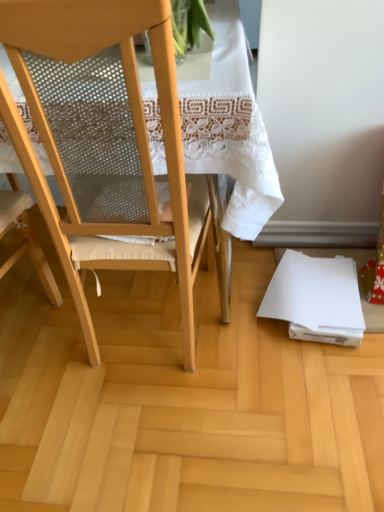
The image size is (384, 512). What are the coordinates of `matte wood chair at center` in the screenshot? It's located at (103, 141).

What do you see at coordinates (182, 402) in the screenshot? The height and width of the screenshot is (512, 384). I see `wooden floor at lower right` at bounding box center [182, 402].

At what (x,y) coordinates should I click in order to perform the action: click on matte wood chair at center. Please return your answer as a coordinate pair (x, y). Looking at the image, I should click on (103, 141).

Image resolution: width=384 pixels, height=512 pixels. Identify the location of notebook located underneath the matte wood chair at center (from a real-world perspective). (316, 298).

Is matte wood chair at center at the right side of white paper at lower right?

Incorrect, matte wood chair at center is not on the right side of white paper at lower right.

From a real-world perspective, relative to white paper at lower right, is matte wood chair at center vertically above or below?

matte wood chair at center is above white paper at lower right.

Considering the sizes of objects matte wood chair at center and white paper at lower right in the image provided, who is taller, matte wood chair at center or white paper at lower right?

matte wood chair at center.

Which is nearer, [182,439] or [289,258]?

Positioned in front is point [182,439].

From the image's perspective, is wooden floor at lower right beneath white paper at lower right?

Correct, wooden floor at lower right appears lower than white paper at lower right in the image.

Image resolution: width=384 pixels, height=512 pixels. Find the location of `notebook above the wooden floor at lower right (from a real-world perspective)`. notebook above the wooden floor at lower right (from a real-world perspective) is located at coordinates (316, 298).

What's the angular difference between wooden floor at lower right and white paper at lower right's facing directions?

wooden floor at lower right and white paper at lower right are facing 94 degrees away from each other.

From a real-world perspective, is matte wood chair at center below wooden floor at lower right?

Actually, matte wood chair at center is physically above wooden floor at lower right in the real world.

From the image's perspective, is matte wood chair at center beneath wooden floor at lower right?

No, from the image's perspective, matte wood chair at center is not beneath wooden floor at lower right.

Which point is more distant from viewer, (181, 210) or (143, 459)?

The point (143, 459) is farther.

Does white paper at lower right have a lesser width compared to matte wood chair at center?

Correct, the width of white paper at lower right is less than that of matte wood chair at center.

From a real-world perspective, is white paper at lower right beneath matte wood chair at center?

Yes, from a real-world perspective, white paper at lower right is below matte wood chair at center.

Is white paper at lower right facing away from matte wood chair at center?

No.

Is white paper at lower right in front of or behind matte wood chair at center in the image?

Clearly, white paper at lower right is behind matte wood chair at center.

Does white paper at lower right touch wooden floor at lower right?

white paper at lower right and wooden floor at lower right are not in contact.

Which is more to the left, white paper at lower right or wooden floor at lower right?

wooden floor at lower right is more to the left.

Considering the relative sizes of white paper at lower right and wooden floor at lower right in the image provided, is white paper at lower right bigger than wooden floor at lower right?

No, white paper at lower right is not bigger than wooden floor at lower right.

Which of these two, wooden floor at lower right or matte wood chair at center, is bigger?

With larger size is matte wood chair at center.

How distant is wooden floor at lower right from matte wood chair at center?

A distance of 16.42 inches exists between wooden floor at lower right and matte wood chair at center.

Is wooden floor at lower right placed right next to matte wood chair at center?

No.

Is matte wood chair at center at the back of wooden floor at lower right?

wooden floor at lower right does not have its back to matte wood chair at center.

Image resolution: width=384 pixels, height=512 pixels. I want to click on notebook on the right side of matte wood chair at center, so click(316, 298).

In the image, there is a white paper at lower right. At what (x,y) coordinates should I click in order to perform the action: click on plywood below it (from the image's perspective). Please return your answer as a coordinate pair (x, y). The width and height of the screenshot is (384, 512). Looking at the image, I should click on (182, 402).

Which object lies nearer to the anchor point matte wood chair at center, wooden floor at lower right or white paper at lower right?

Based on the image, wooden floor at lower right appears to be nearer to matte wood chair at center.

Considering their positions, is white paper at lower right positioned further to wooden floor at lower right than matte wood chair at center?

Based on the image, matte wood chair at center appears to be further to wooden floor at lower right.

When comparing their distances from white paper at lower right, does wooden floor at lower right or matte wood chair at center seem further?

The object further to white paper at lower right is matte wood chair at center.

Estimate the real-world distances between objects in this image. Which object is further from matte wood chair at center, white paper at lower right or wooden floor at lower right?

Based on the image, white paper at lower right appears to be further to matte wood chair at center.

Estimate the real-world distances between objects in this image. Which object is further from wooden floor at lower right, matte wood chair at center or white paper at lower right?

Among the two, matte wood chair at center is located further to wooden floor at lower right.

Which object lies nearer to the anchor point white paper at lower right, matte wood chair at center or wooden floor at lower right?

wooden floor at lower right.

You are a GUI agent. You are given a task and a screenshot of the screen. Output one action in this format:
    pyautogui.click(x=<x>, y=<y>)
    Task: Click on the plywood located between matte wood chair at center and white paper at lower right in the depth direction
    
    Given the screenshot: What is the action you would take?
    pyautogui.click(x=182, y=402)